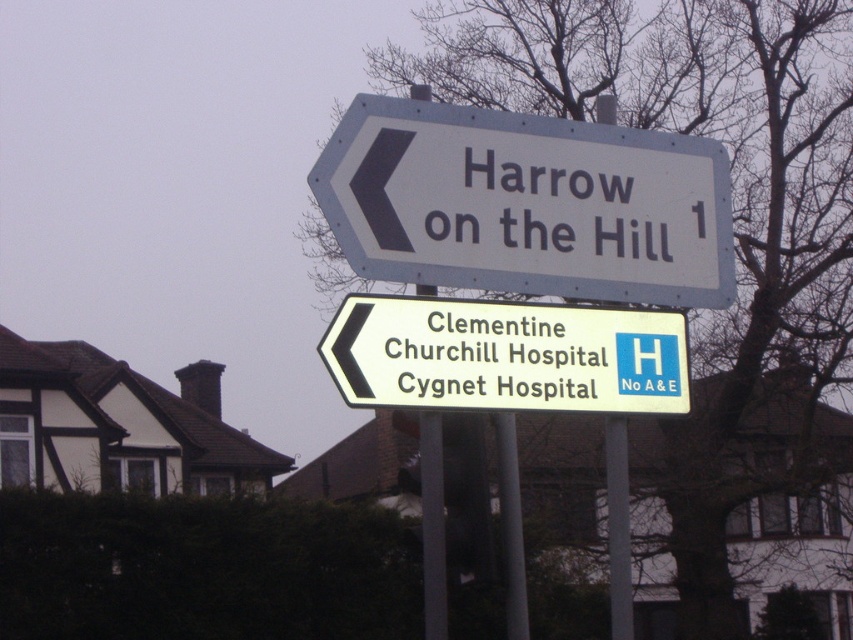
Question: Based on their relative distances, which object is farther from the white plastic sign at upper center?

Choices:
 (A) metallic pole at center
 (B) white plastic sign at lower center

Answer: (A)

Question: Which point is closer to the camera?

Choices:
 (A) metallic pole at center
 (B) white plastic sign at lower center
 (C) white plastic sign at upper center

Answer: (B)

Question: Among these objects, which one is nearest to the camera?

Choices:
 (A) white plastic sign at upper center
 (B) white plastic sign at lower center

Answer: (B)

Question: Does white plastic sign at upper center have a greater width compared to metallic pole at center?

Choices:
 (A) no
 (B) yes

Answer: (B)

Question: Can you confirm if white plastic sign at lower center is positioned below metallic pole at center?

Choices:
 (A) yes
 (B) no

Answer: (B)

Question: Is white plastic sign at lower center above metallic pole at center?

Choices:
 (A) no
 (B) yes

Answer: (B)